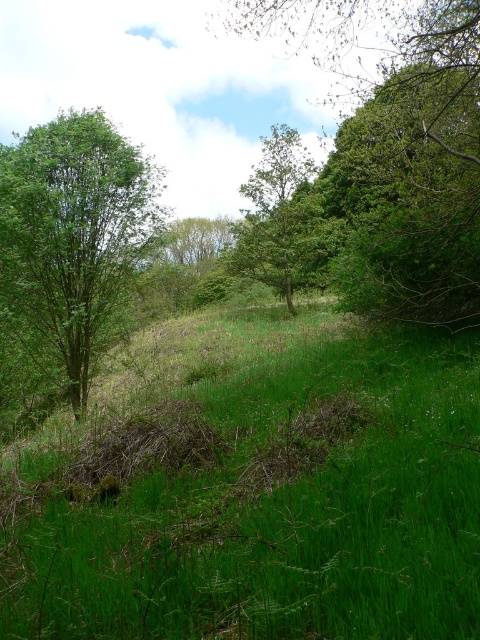
You are standing in the meadow and want to take a photo of both the green leafy tree at upper center and the green leafy tree at left. Which tree should you position closer to the camera to include both in the frame?

To include both the green leafy tree at upper center and the green leafy tree at left in the frame, position the shorter green leafy tree at left closer to the camera since it is shorter than the green leafy tree at upper center.

You are a hiker trying to navigate through the meadow. You see the green leafy tree at upper center and the green leafy tree at center. Which tree is closer to your left side when facing the direction of the background?

The green leafy tree at center is closer to your left side because the green leafy tree at upper center is positioned on its right side, meaning it is to the right of the observer when facing the background.

You are standing in the meadow and want to walk towards the two points marked in the image. Which point, point (235, 448) or point (352, 150), will you reach first?

You will reach point (235, 448) first because it is closer to the camera than point (352, 150).